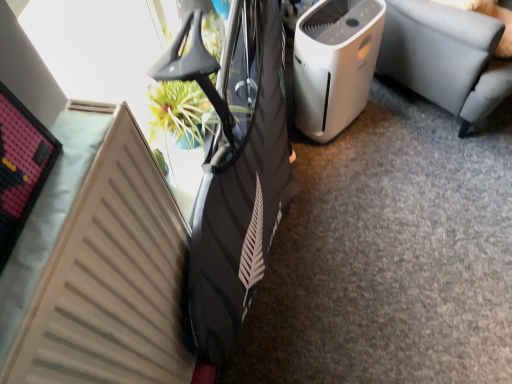
What is the approximate width of white plastic air purifier at center-right?

It is 9.78 inches.

Describe the element at coordinates (335, 64) in the screenshot. I see `white plastic air purifier at center-right` at that location.

What do you see at coordinates (98, 264) in the screenshot? I see `beige matte radiator at lower left` at bounding box center [98, 264].

Where is `white plastic air purifier at center-right`? The width and height of the screenshot is (512, 384). white plastic air purifier at center-right is located at coordinates pos(335,64).

Is white plastic air purifier at center-right facing away from beige matte radiator at lower left?

No.

Is white plastic air purifier at center-right spatially inside beige matte radiator at lower left, or outside of it?

white plastic air purifier at center-right exists outside the volume of beige matte radiator at lower left.

Considering the sizes of objects white plastic air purifier at center-right and beige matte radiator at lower left in the image provided, who is taller, white plastic air purifier at center-right or beige matte radiator at lower left?

beige matte radiator at lower left.

From a real-world perspective, between white plastic air purifier at center-right and beige matte radiator at lower left, who is vertically higher?

beige matte radiator at lower left is physically above.

Find the location of a particular element. radiator in front of the white plastic air purifier at center right is located at coordinates (98, 264).

Considering the positions of objects beige matte radiator at lower left and white plastic air purifier at center right in the image provided, who is more to the left, beige matte radiator at lower left or white plastic air purifier at center right?

beige matte radiator at lower left.

Does point (148, 283) come behind point (409, 35)?

No.

Which object is thinner, beige matte radiator at lower left or white plastic air purifier at center right?

beige matte radiator at lower left.

Looking at this image, can you confirm if white plastic air purifier at center-right is bigger than white plastic air purifier at center right?

No, white plastic air purifier at center-right is not bigger than white plastic air purifier at center right.

Does white plastic air purifier at center-right have a greater height compared to white plastic air purifier at center right?

Incorrect, the height of white plastic air purifier at center-right is not larger of that of white plastic air purifier at center right.

Which is closer to the camera, (324, 36) or (437, 40)?

Point (324, 36) appears to be closer to the viewer than point (437, 40).

Which of these two, white plastic air purifier at center right or beige matte radiator at lower left, stands shorter?

With less height is white plastic air purifier at center right.

Considering the relative sizes of white plastic air purifier at center right and beige matte radiator at lower left in the image provided, is white plastic air purifier at center right bigger than beige matte radiator at lower left?

Yes.

Is point (438, 76) farther from camera compared to point (77, 114)?

That is True.

Is white plastic air purifier at center right aimed at beige matte radiator at lower left?

No, white plastic air purifier at center right does not turn towards beige matte radiator at lower left.

Which of these two, beige matte radiator at lower left or white plastic air purifier at center-right, stands taller?

With more height is beige matte radiator at lower left.

Which object is more forward, beige matte radiator at lower left or white plastic air purifier at center-right?

beige matte radiator at lower left is in front.

You are a GUI agent. You are given a task and a screenshot of the screen. Output one action in this format:
    pyautogui.click(x=<x>, y=<y>)
    Task: Click on the radiator in front of the white plastic air purifier at center-right
    The height and width of the screenshot is (384, 512).
    Given the screenshot: What is the action you would take?
    pyautogui.click(x=98, y=264)

Does white plastic air purifier at center right come in front of white plastic air purifier at center-right?

Yes, it is.

Considering the relative positions of white plastic air purifier at center right and white plastic air purifier at center-right in the image provided, is white plastic air purifier at center right to the right of white plastic air purifier at center-right from the viewer's perspective?

Yes.

Is white plastic air purifier at center right oriented away from white plastic air purifier at center-right?

No.

I want to click on radiator in front of the white plastic air purifier at center-right, so click(98, 264).

Where is `radiator lying on the left of white plastic air purifier at center right`? This screenshot has width=512, height=384. radiator lying on the left of white plastic air purifier at center right is located at coordinates (98, 264).

Based on their spatial positions, is white plastic air purifier at center-right or beige matte radiator at lower left closer to white plastic air purifier at center right?

white plastic air purifier at center-right is positioned closer to the anchor white plastic air purifier at center right.

Considering their positions, is white plastic air purifier at center right positioned further to white plastic air purifier at center-right than beige matte radiator at lower left?

Based on the image, beige matte radiator at lower left appears to be further to white plastic air purifier at center-right.

Estimate the real-world distances between objects in this image. Which object is closer to beige matte radiator at lower left, white plastic air purifier at center-right or white plastic air purifier at center right?

white plastic air purifier at center-right lies closer to beige matte radiator at lower left than the other object.

From the image, which object appears to be farther from white plastic air purifier at center right, beige matte radiator at lower left or white plastic air purifier at center-right?

The object further to white plastic air purifier at center right is beige matte radiator at lower left.

From the image, which object appears to be nearer to beige matte radiator at lower left, white plastic air purifier at center right or white plastic air purifier at center-right?

Based on the image, white plastic air purifier at center-right appears to be nearer to beige matte radiator at lower left.

Looking at the image, which one is located further to white plastic air purifier at center-right, beige matte radiator at lower left or white plastic air purifier at center right?

Based on the image, beige matte radiator at lower left appears to be further to white plastic air purifier at center-right.

You are a GUI agent. You are given a task and a screenshot of the screen. Output one action in this format:
    pyautogui.click(x=<x>, y=<y>)
    Task: Click on the home appliance between white plastic air purifier at center right and beige matte radiator at lower left in the vertical direction
    The image size is (512, 384).
    Given the screenshot: What is the action you would take?
    pyautogui.click(x=335, y=64)